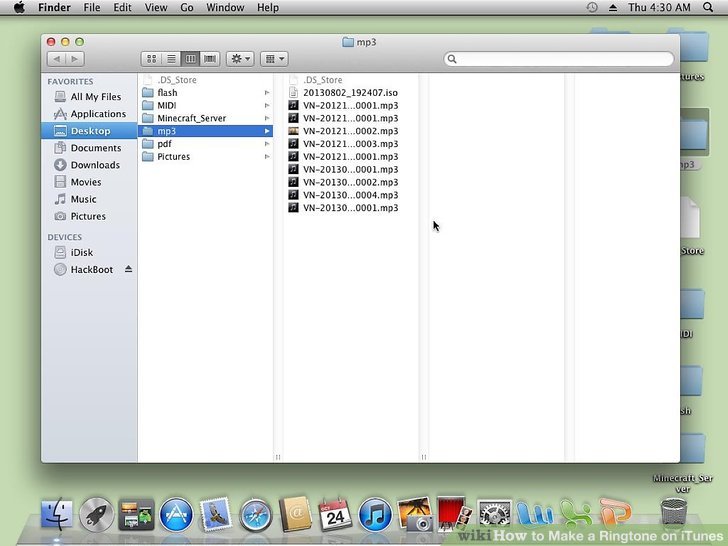
Where is `files`? files is located at coordinates (697, 60), (697, 121), (694, 217), (697, 311), (689, 373), (689, 441), (608, 29).